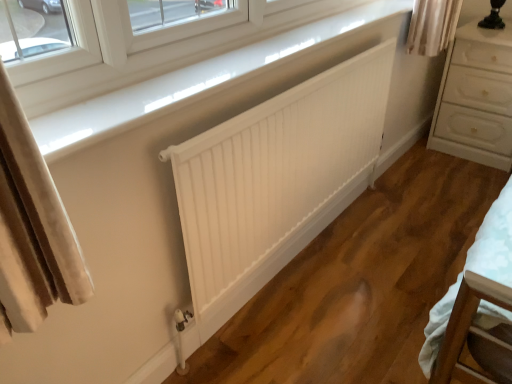
Question: From the image's perspective, would you say white glossy chest of drawers at right is shown under white matte radiator at center?

Choices:
 (A) yes
 (B) no

Answer: (B)

Question: Considering the relative sizes of white glossy chest of drawers at right and white matte radiator at center in the image provided, is white glossy chest of drawers at right shorter than white matte radiator at center?

Choices:
 (A) yes
 (B) no

Answer: (A)

Question: From the image's perspective, would you say white glossy chest of drawers at right is positioned over white matte radiator at center?

Choices:
 (A) no
 (B) yes

Answer: (B)

Question: Is white glossy chest of drawers at right wider than white matte radiator at center?

Choices:
 (A) no
 (B) yes

Answer: (B)

Question: From a real-world perspective, is white glossy chest of drawers at right beneath white matte radiator at center?

Choices:
 (A) yes
 (B) no

Answer: (A)

Question: Is white glossy chest of drawers at right turned away from white matte radiator at center?

Choices:
 (A) no
 (B) yes

Answer: (A)

Question: Can you confirm if white glossy chest of drawers at right is wider than white glossy window sill at upper center?

Choices:
 (A) no
 (B) yes

Answer: (B)

Question: Is the surface of white glossy chest of drawers at right in direct contact with white glossy window sill at upper center?

Choices:
 (A) no
 (B) yes

Answer: (A)

Question: From a real-world perspective, is white glossy chest of drawers at right located beneath white glossy window sill at upper center?

Choices:
 (A) yes
 (B) no

Answer: (A)

Question: Is white glossy chest of drawers at right at the left side of white glossy window sill at upper center?

Choices:
 (A) no
 (B) yes

Answer: (A)

Question: Does white glossy chest of drawers at right have a larger size compared to white glossy window sill at upper center?

Choices:
 (A) yes
 (B) no

Answer: (A)

Question: Does white glossy chest of drawers at right appear on the right side of white glossy window sill at upper center?

Choices:
 (A) no
 (B) yes

Answer: (B)

Question: Is white glossy window sill at upper center completely or partially outside of white matte radiator at center?

Choices:
 (A) yes
 (B) no

Answer: (A)